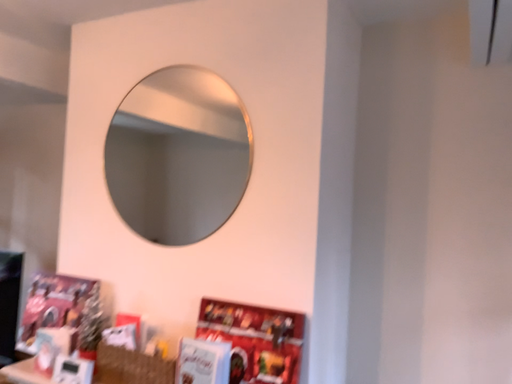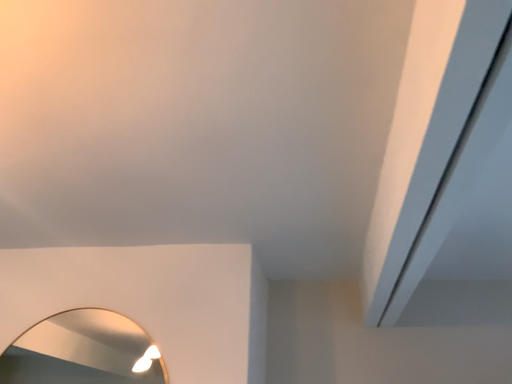
Question: Which way did the camera rotate in the video?

Choices:
 (A) rotated downward
 (B) rotated upward

Answer: (B)